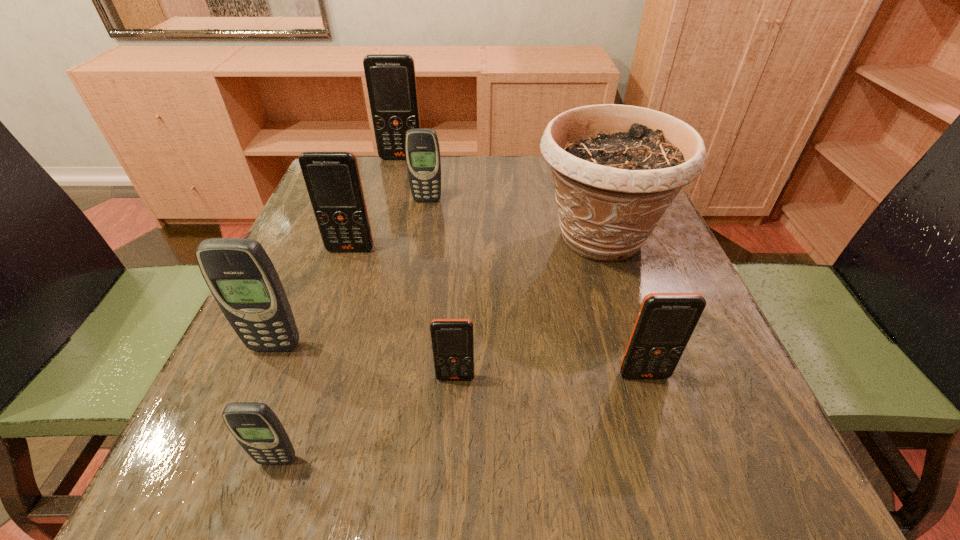
At what (x,y) coordinates should I click in order to perform the action: click on free space at the near edge of the desktop. Please return your answer as a coordinate pair (x, y). The width and height of the screenshot is (960, 540). Looking at the image, I should click on (612, 477).

Identify the location of vacant area at the left edge. (286, 260).

Identify the location of vacant space at the right edge. (636, 293).

What are the coordinates of `blank region between the third object from right to left and the fifth nearest cellular telephone` in the screenshot? It's located at (403, 314).

In order to click on free spot between the farthest gray cellular telephone and the second cellular telephone from right to left in this screenshot , I will do `click(442, 289)`.

Locate an element on the screen. This screenshot has width=960, height=540. free space that is in between the second smallest gray cellular telephone and the biggest gray cellular telephone is located at coordinates (351, 274).

This screenshot has height=540, width=960. I want to click on vacant point located between the third object from right to left and the nearest gray cellular telephone, so click(367, 419).

Find the location of a particular element. This screenshot has width=960, height=540. free space between the farthest gray cellular telephone and the third smallest orange cellular telephone is located at coordinates (389, 225).

Where is `vacant space that's between the rightmost gray cellular telephone and the fourth farthest cellular telephone`? vacant space that's between the rightmost gray cellular telephone and the fourth farthest cellular telephone is located at coordinates (351, 274).

Locate an element on the screen. blank region between the farthest cellular telephone and the second orange cellular telephone from right to left is located at coordinates (428, 268).